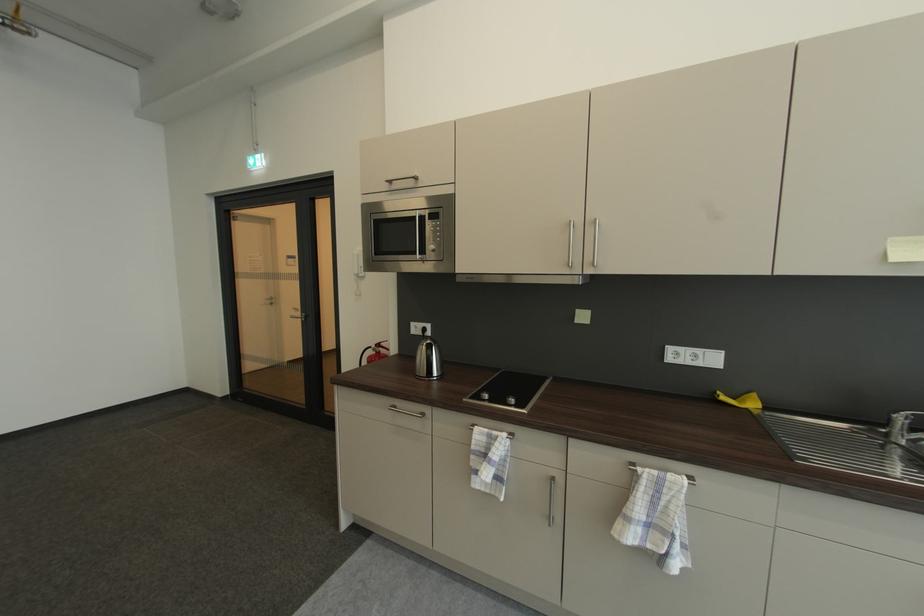
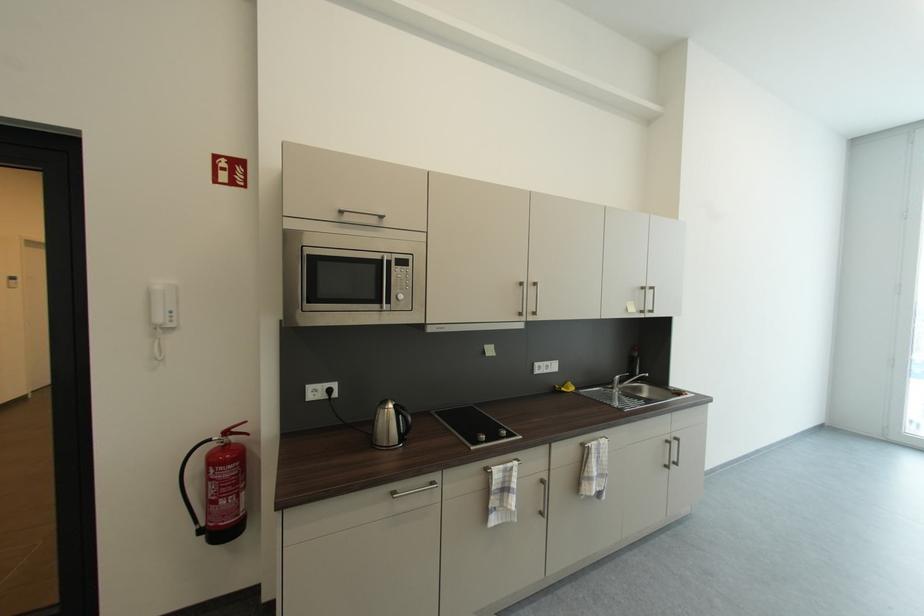
Find the pixel in the second image that matches (730,400) in the first image.

(569, 391)